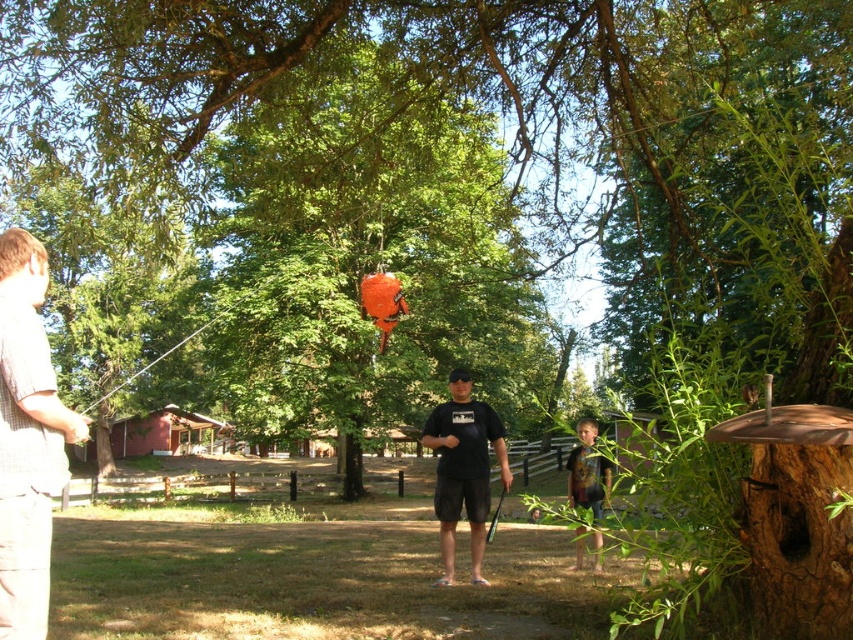
Can you confirm if plaid shirt at left is wider than multicolored fabric shirt at lower right?

Incorrect, plaid shirt at left's width does not surpass multicolored fabric shirt at lower right's.

Is plaid shirt at left thinner than multicolored fabric shirt at lower right?

Yes, plaid shirt at left is thinner than multicolored fabric shirt at lower right.

I want to click on plaid shirt at left, so click(x=27, y=438).

Find the location of a particular element. This screenshot has width=853, height=640. plaid shirt at left is located at coordinates (27, 438).

Is black matte t-shirt at center thinner than multicolored fabric shirt at lower right?

Yes.

From the picture: Does black matte t-shirt at center have a greater height compared to multicolored fabric shirt at lower right?

In fact, black matte t-shirt at center may be shorter than multicolored fabric shirt at lower right.

Between point (485, 468) and point (605, 483), which one is positioned behind?

Positioned behind is point (605, 483).

Locate an element on the screen. This screenshot has width=853, height=640. black matte t-shirt at center is located at coordinates [463, 468].

Between plaid shirt at left and black matte t-shirt at center, which one has more height?

With more height is plaid shirt at left.

Who is higher up, plaid shirt at left or black matte t-shirt at center?

Positioned higher is plaid shirt at left.

Between point (38, 246) and point (451, 387), which one is positioned in front?

Point (38, 246)

This screenshot has height=640, width=853. Identify the location of plaid shirt at left. (27, 438).